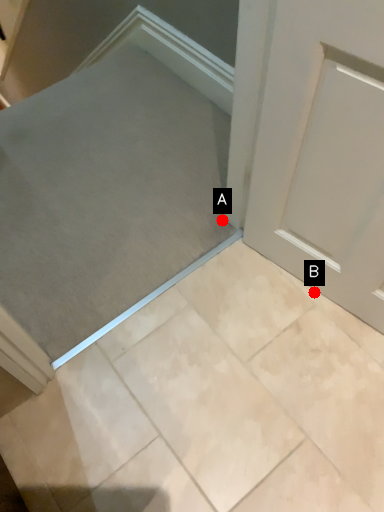
Question: Two points are circled on the image, labeled by A and B beside each circle. Which point is closer to the camera?

Choices:
 (A) A is closer
 (B) B is closer

Answer: (B)